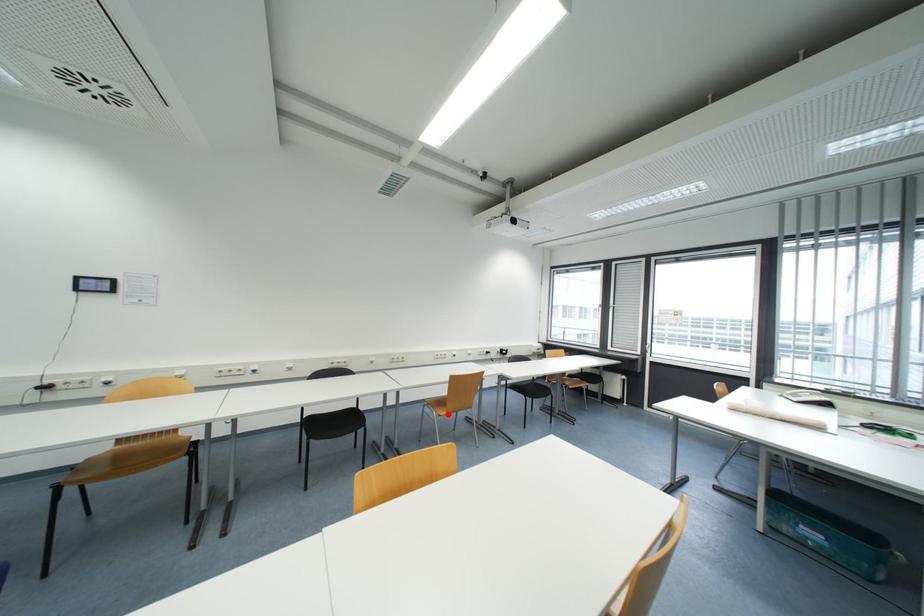
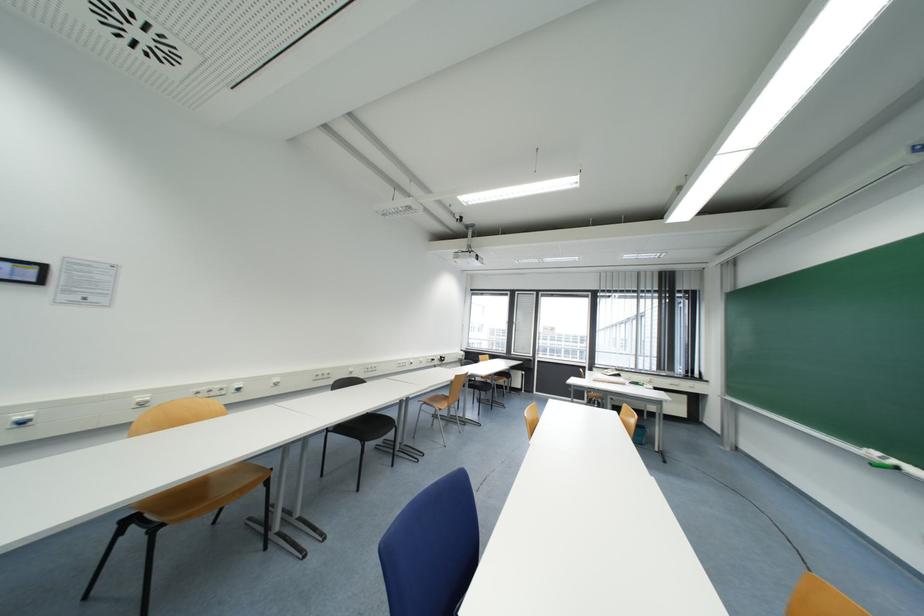
Locate, in the second image, the point that corresponds to the highlighted location in the first image.

(448, 408)